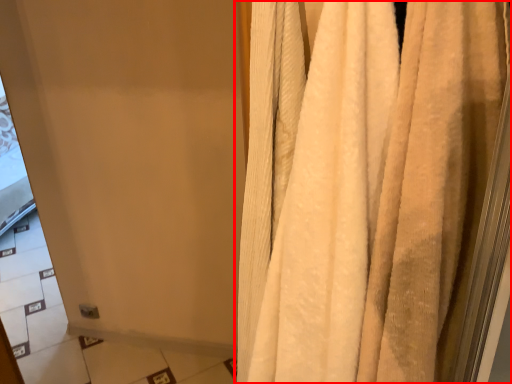
Question: Observing the image, what is the correct spatial positioning of curtain (annotated by the red box) in reference to screen door?

Choices:
 (A) right
 (B) left

Answer: (A)